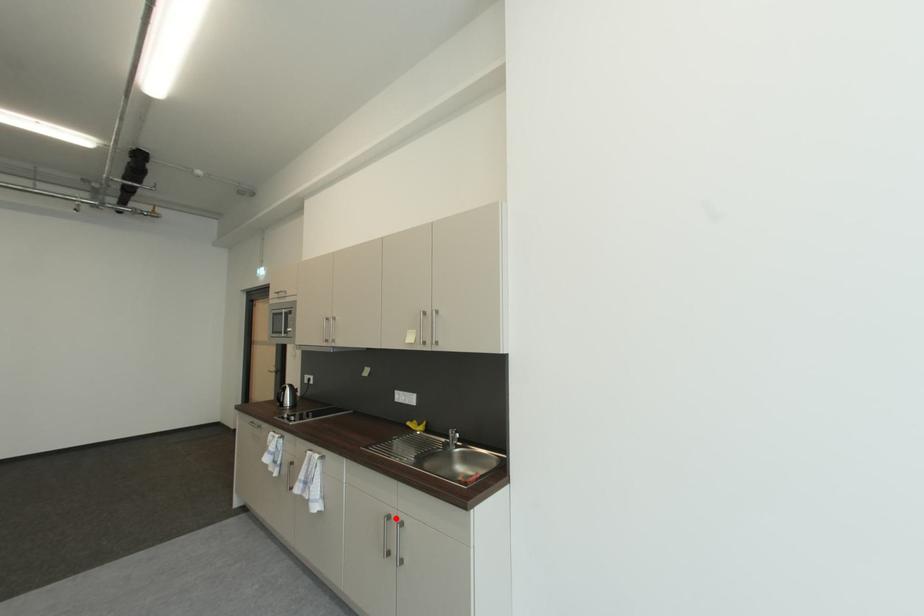
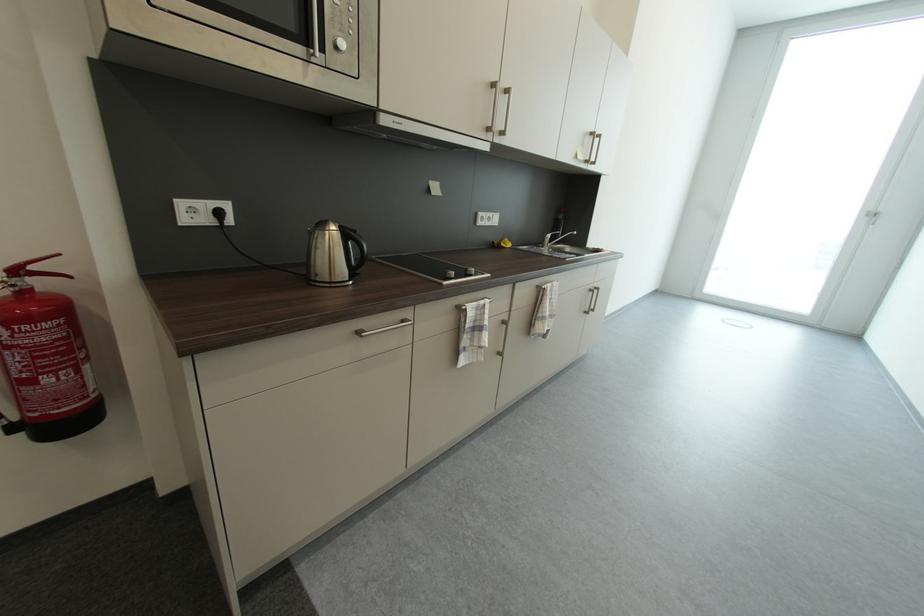
Question: A red point is marked in image1. In image2, is the corresponding 3D point closer to the camera or farther? Reply with the corresponding letter.

Choices:
 (A) The corresponding 3D point is closer.
 (B) The corresponding 3D point is farther.

Answer: (A)